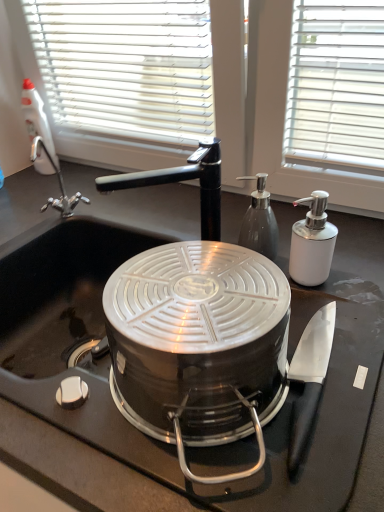
This screenshot has width=384, height=512. Find the location of `blank space situated above black matte sink at center (from a real-world perspective)`. blank space situated above black matte sink at center (from a real-world perspective) is located at coordinates [161, 234].